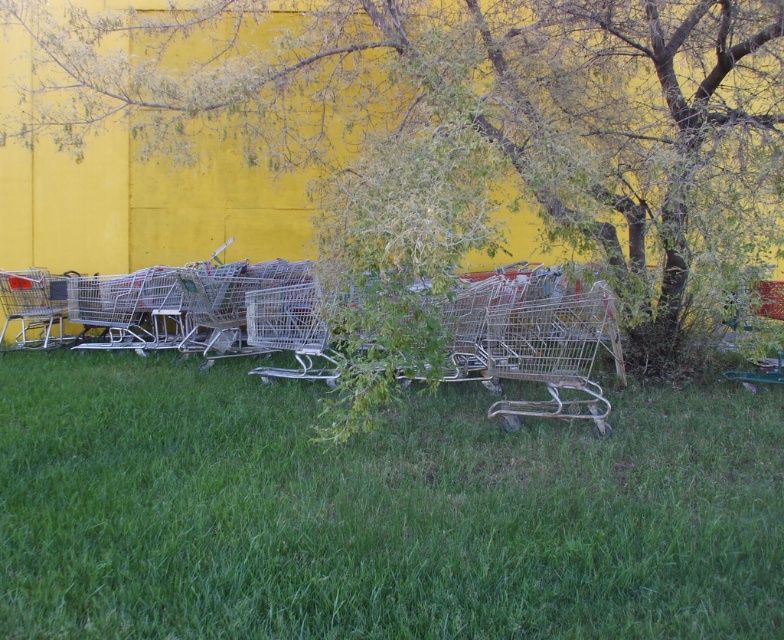
Question: Considering the relative positions of green grass at lower center and green leafy tree at center in the image provided, where is green grass at lower center located with respect to green leafy tree at center?

Choices:
 (A) left
 (B) right

Answer: (B)

Question: Which point is closer to the camera?

Choices:
 (A) (695, 221)
 (B) (31, 300)
 (C) (688, 468)

Answer: (A)

Question: Among these objects, which one is farthest from the camera?

Choices:
 (A) green grass at lower center
 (B) metallic silver shopping cart at center
 (C) silver metallic shopping cart at left
 (D) metallic silver shopping cart at right

Answer: (C)

Question: Which of the following is the farthest from the observer?

Choices:
 (A) green leafy tree at center
 (B) metallic silver shopping cart at right
 (C) metallic silver shopping cart at center

Answer: (B)

Question: Does green grass at lower center appear under silver metallic shopping cart at left?

Choices:
 (A) yes
 (B) no

Answer: (A)

Question: Is silver metallic shopping cart at left positioned in front of metallic silver shopping cart at right?

Choices:
 (A) yes
 (B) no

Answer: (B)